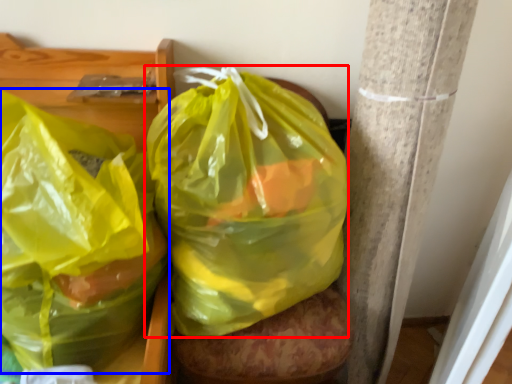
Question: Which object appears farthest to the camera in this image, plastic bag (highlighted by a red box) or plastic bag (highlighted by a blue box)?

Choices:
 (A) plastic bag
 (B) plastic bag

Answer: (A)